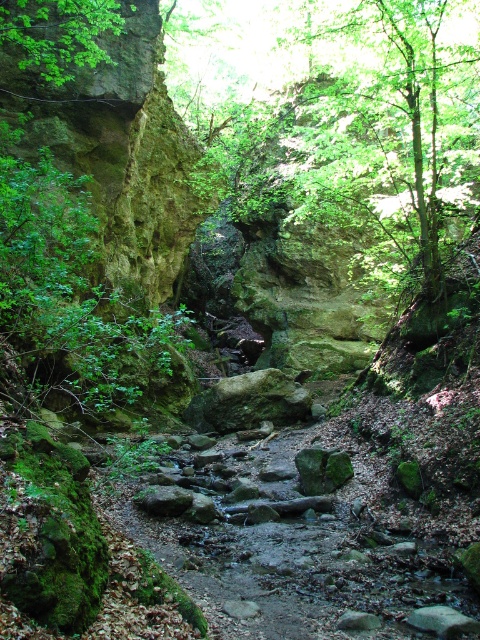
Is green leafy tree at center behind green leafy tree at upper left?

Yes, it is behind green leafy tree at upper left.

What do you see at coordinates (396, 134) in the screenshot?
I see `green leafy tree at center` at bounding box center [396, 134].

I want to click on green leafy tree at center, so click(396, 134).

Find the location of a particular element. The image size is (480, 640). green leafy tree at center is located at coordinates (396, 134).